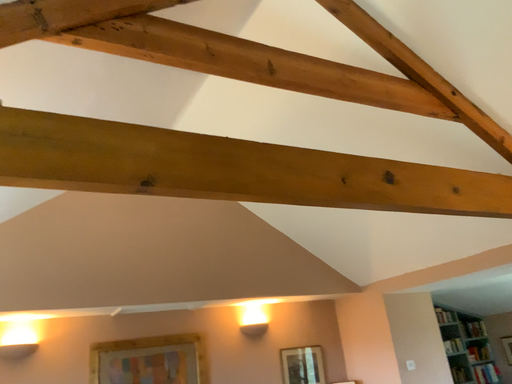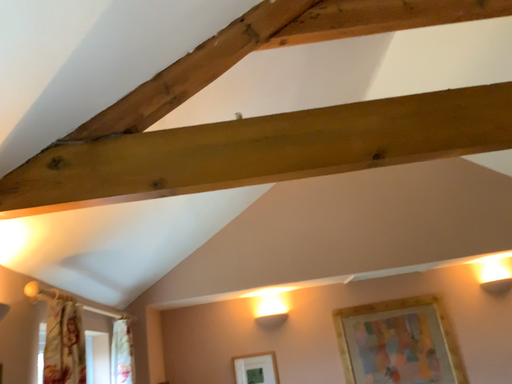
Question: Which way did the camera rotate in the video?

Choices:
 (A) rotated downward
 (B) rotated upward

Answer: (A)